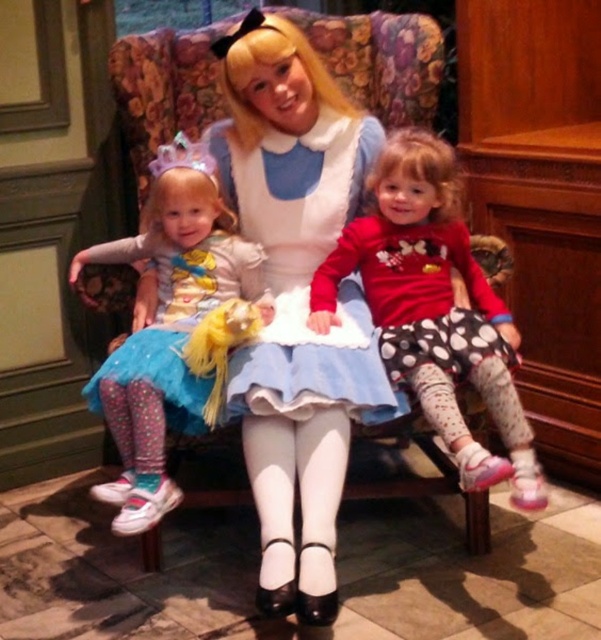
You are a photographer trying to capture a clear shot of the polka dot leggings at center and the blue tulle skirt at left. Based on their heights, which one is more likely to be fully visible in the photo?

The polka dot leggings at center has a greater height compared to the blue tulle skirt at left, so it is more likely to be fully visible in the photo.

You are a photographer trying to capture the perfect shot of the scene. You notice the polka dot leggings at center. Based on their position, where would you aim your camera to ensure they are in the frame?

The polka dot leggings at center are located at point [433,308], so you should aim your camera towards that coordinate to include them in the frame.